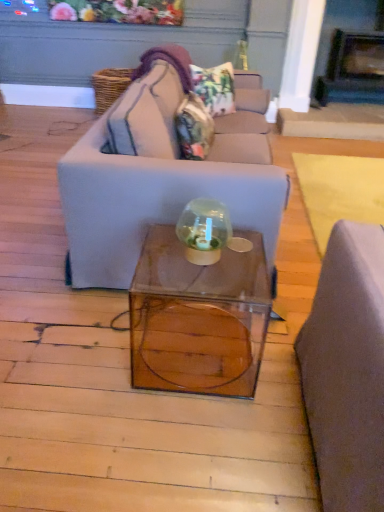
Question: Is matte gray couch at center not inside camouflage fabric pillow at center, the 1th pillow positioned from the bottom?

Choices:
 (A) no
 (B) yes

Answer: (B)

Question: Is there a large distance between matte gray couch at center and camouflage fabric pillow at center, the 1th pillow positioned from the bottom?

Choices:
 (A) yes
 (B) no

Answer: (B)

Question: Can you confirm if matte gray couch at center is smaller than camouflage fabric pillow at center, the 1th pillow positioned from the bottom?

Choices:
 (A) no
 (B) yes

Answer: (A)

Question: Is matte gray couch at center facing towards camouflage fabric pillow at center, which is counted as the second pillow, starting from the top?

Choices:
 (A) yes
 (B) no

Answer: (A)

Question: Does matte gray couch at center appear on the right side of camouflage fabric pillow at center, which is counted as the second pillow, starting from the top?

Choices:
 (A) no
 (B) yes

Answer: (B)

Question: From a real-world perspective, is camouflage fabric pillow at center, the 1th pillow positioned from the bottom, physically located above or below floral fabric pillow at upper center, which ranks as the 2th pillow in bottom-to-top order?

Choices:
 (A) above
 (B) below

Answer: (B)

Question: Relative to floral fabric pillow at upper center, the first pillow positioned from the top, is camouflage fabric pillow at center, the 1th pillow positioned from the bottom, in front or behind?

Choices:
 (A) front
 (B) behind

Answer: (A)

Question: Would you say camouflage fabric pillow at center, which is counted as the second pillow, starting from the top, is to the left or to the right of floral fabric pillow at upper center, which ranks as the 2th pillow in bottom-to-top order, in the picture?

Choices:
 (A) right
 (B) left

Answer: (B)

Question: Based on their sizes in the image, would you say camouflage fabric pillow at center, the 1th pillow positioned from the bottom, is bigger or smaller than floral fabric pillow at upper center, the first pillow positioned from the top?

Choices:
 (A) small
 (B) big

Answer: (B)

Question: Is transparent glass cube at center inside the boundaries of floral fabric pillow at upper center, which ranks as the 2th pillow in bottom-to-top order, or outside?

Choices:
 (A) inside
 (B) outside

Answer: (B)

Question: In terms of height, does transparent glass cube at center look taller or shorter compared to floral fabric pillow at upper center, which ranks as the 2th pillow in bottom-to-top order?

Choices:
 (A) tall
 (B) short

Answer: (A)

Question: Considering the relative positions of transparent glass cube at center and floral fabric pillow at upper center, the first pillow positioned from the top, in the image provided, is transparent glass cube at center to the left or to the right of floral fabric pillow at upper center, the first pillow positioned from the top,?

Choices:
 (A) left
 (B) right

Answer: (A)

Question: From a real-world perspective, is transparent glass cube at center physically located above or below floral fabric pillow at upper center, the first pillow positioned from the top?

Choices:
 (A) above
 (B) below

Answer: (B)

Question: Considering their positions, is dark gray stone fireplace at upper right located in front of or behind transparent glass cube at center?

Choices:
 (A) front
 (B) behind

Answer: (B)

Question: Considering the positions of dark gray stone fireplace at upper right and transparent glass cube at center in the image, is dark gray stone fireplace at upper right taller or shorter than transparent glass cube at center?

Choices:
 (A) short
 (B) tall

Answer: (B)